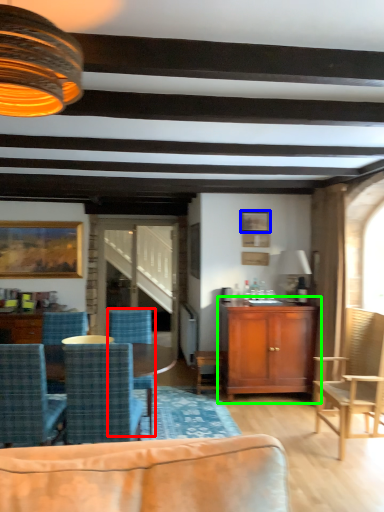
Question: Which object is positioned closest to chair (highlighted by a red box)? Select from picture frame (highlighted by a blue box) and cabinetry (highlighted by a green box).

Choices:
 (A) picture frame
 (B) cabinetry

Answer: (B)